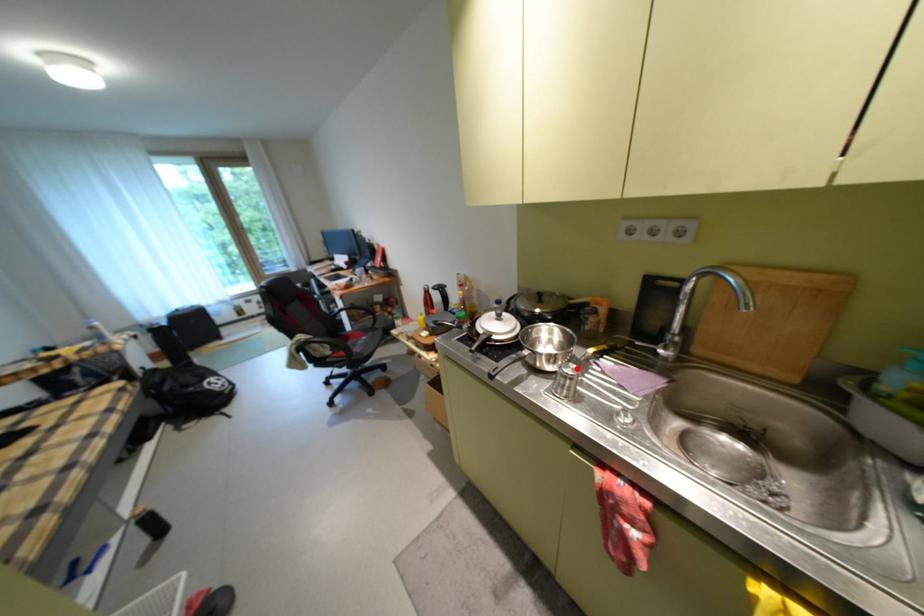
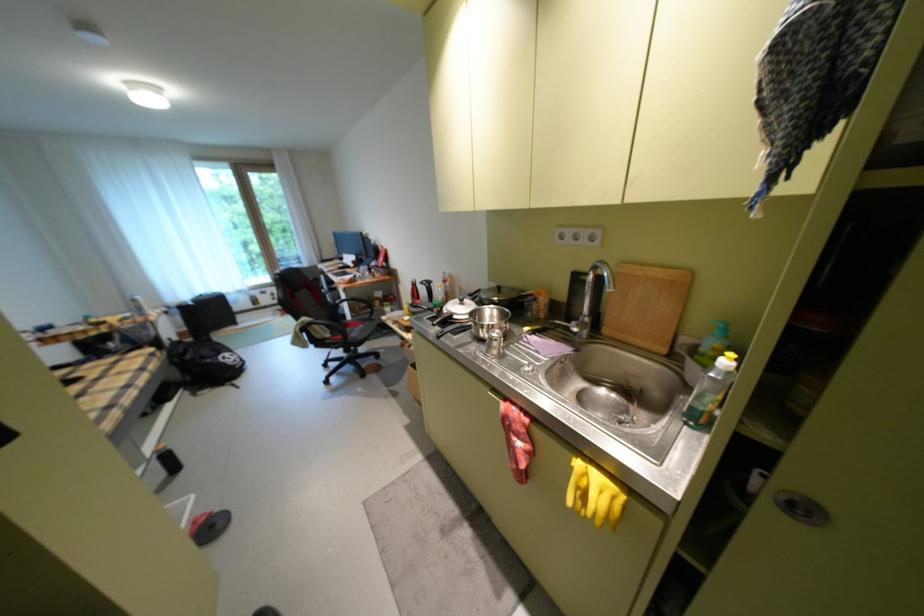
Find the pixel in the second image that matches the highlighted location in the first image.

(504, 333)